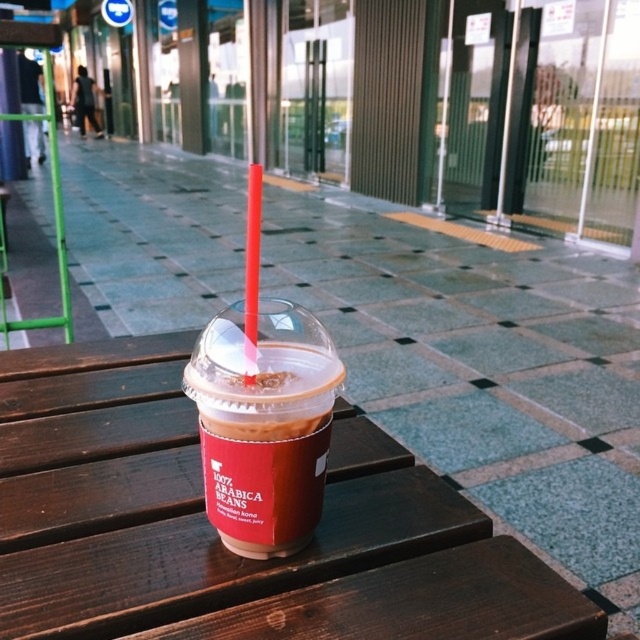
You have a small toy car that is 10 cm long. You want to place it on the brown wooden picnic table at center and the matte plastic cup at center. Which surface can accommodate the toy car without it hanging off?

The brown wooden picnic table at center has a larger width than the matte plastic cup at center, so the toy car can be placed on the brown wooden picnic table at center without hanging off.

You are setting up for a picnic and have a brown wooden picnic table at center and a matte plastic cup at center. Which object would you place a large platter of food on, and why?

You should place the large platter of food on the brown wooden picnic table at center because it is larger in size than the matte plastic cup at center, making it more suitable for holding heavier items.

You are a painter standing at the edge of a park and looking at the brown wooden picnic table at center and the matte plastic cup at center. Which object is closer to you?

The brown wooden picnic table at center is closer to you because it is positioned in front of the matte plastic cup at center.